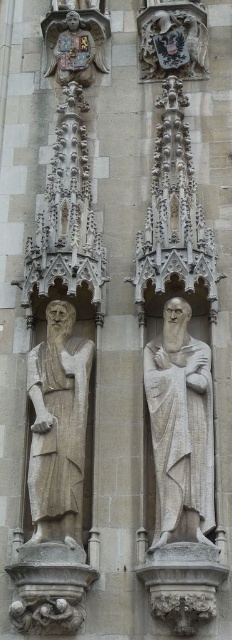
Question: Which object appears farthest from the camera in this image?

Choices:
 (A) stone statue at center
 (B) white stone statue at center

Answer: (A)

Question: Does white stone statue at center have a greater width compared to stone statue at center?

Choices:
 (A) no
 (B) yes

Answer: (A)

Question: Does white stone statue at center have a greater width compared to stone statue at center?

Choices:
 (A) yes
 (B) no

Answer: (B)

Question: Which object is farther from the camera taking this photo?

Choices:
 (A) white stone statue at center
 (B) stone statue at center

Answer: (B)

Question: Does white stone statue at center have a smaller size compared to stone statue at center?

Choices:
 (A) yes
 (B) no

Answer: (A)